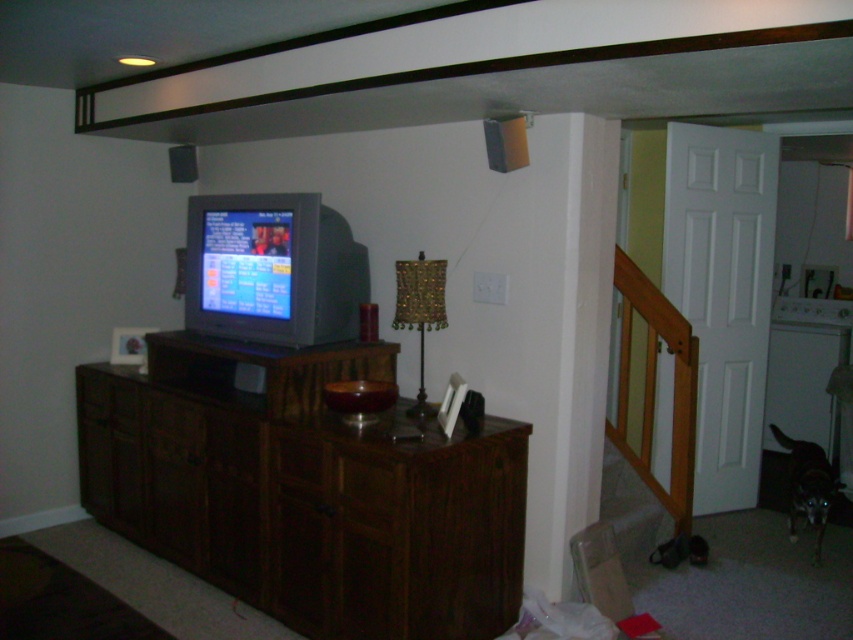
You are moving a large piece of furniture into this dimly lit room. The room has a matte gray tv at center and a brown wood drawer at center. Which object should you avoid moving near the entrance to ensure there is enough space?

The matte gray tv at center is larger in size than the brown wood drawer at center, so you should avoid moving the matte gray tv at center near the entrance to ensure there is enough space.

You are a delivery person who just arrived at a house. You need to place a package on the dark wood dresser at center. Where should you place it?

The dark wood dresser at center is located at the coordinates (305,492), so place the package there.

You are standing in the room shown in the image. If you want to place a new object exactly where the dark wood dresser at center is currently located, where should you place it?

The dark wood dresser at center is located at the 2D coordinates point (305, 492), so you should place the new object at that exact point.